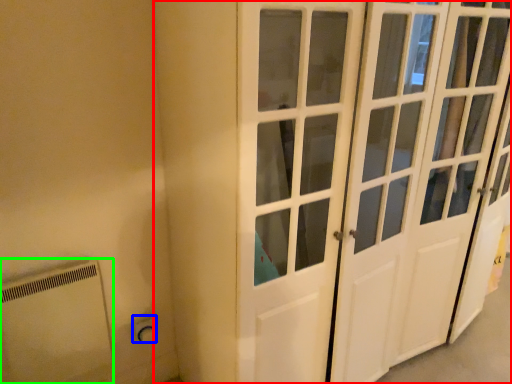
Question: Based on their relative distances, which object is farther from door (highlighted by a red box)? Choose from electric outlet (highlighted by a blue box) and appliance (highlighted by a green box).

Choices:
 (A) electric outlet
 (B) appliance

Answer: (A)